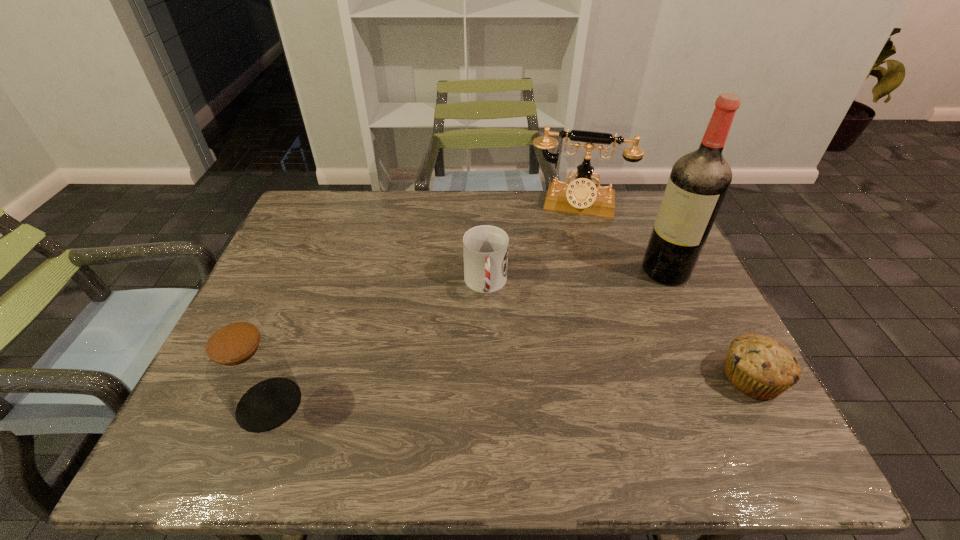
You are a GUI agent. You are given a task and a screenshot of the screen. Output one action in this format:
    pyautogui.click(x=<x>, y=<y>)
    Task: Click on the vacant space that satisfies the following two spatial constraints: 1. on the front side of the liquor; 2. on the left side of the telephone
    Image resolution: width=960 pixels, height=540 pixels.
    Given the screenshot: What is the action you would take?
    pyautogui.click(x=596, y=271)